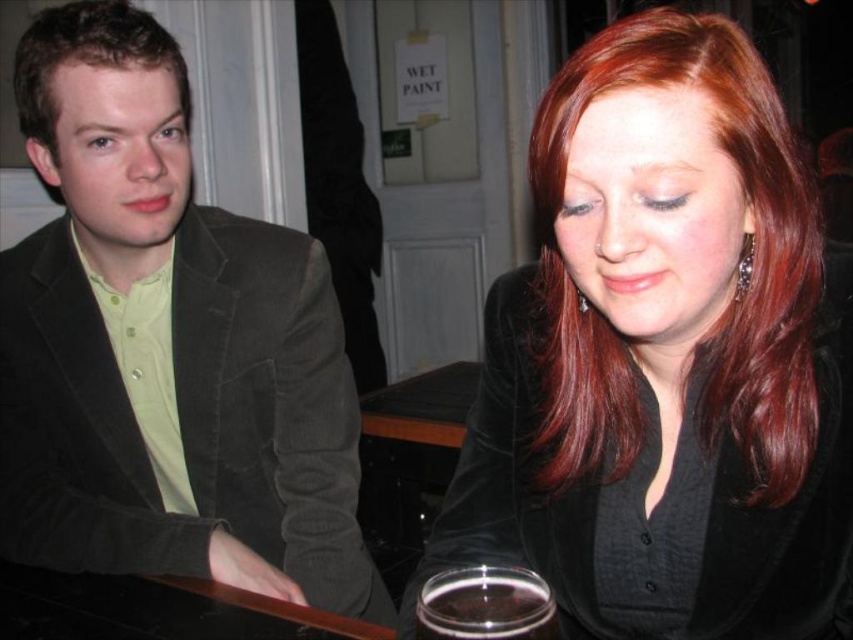
Is black velvet blazer at center positioned at the back of brown velvety hair at left?

No, black velvet blazer at center is in front of brown velvety hair at left.

From the picture: Can you confirm if black velvet blazer at center is shorter than brown velvety hair at left?

No.

Is point (494, 420) positioned behind point (47, 74)?

No, it is in front of (47, 74).

Identify the location of black velvet blazer at center. This screenshot has width=853, height=640. (784, 529).

Looking at this image, is velvet green blazer at left below clear glass cup at lower center?

No, velvet green blazer at left is not below clear glass cup at lower center.

Does point (143, 461) come in front of point (538, 596)?

No, (143, 461) is behind (538, 596).

Is point (107, 232) positioned before point (526, 637)?

No, (107, 232) is behind (526, 637).

Where is `velvet green blazer at left`? The width and height of the screenshot is (853, 640). velvet green blazer at left is located at coordinates (166, 346).

Looking at this image, who is taller, velvet green blazer at left or brown velvety hair at left?

velvet green blazer at left

Who is more distant from viewer, (294, 456) or (160, 35)?

Point (294, 456)

At what (x,y) coordinates should I click in order to perform the action: click on velvet green blazer at left. Please return your answer as a coordinate pair (x, y). The height and width of the screenshot is (640, 853). Looking at the image, I should click on (166, 346).